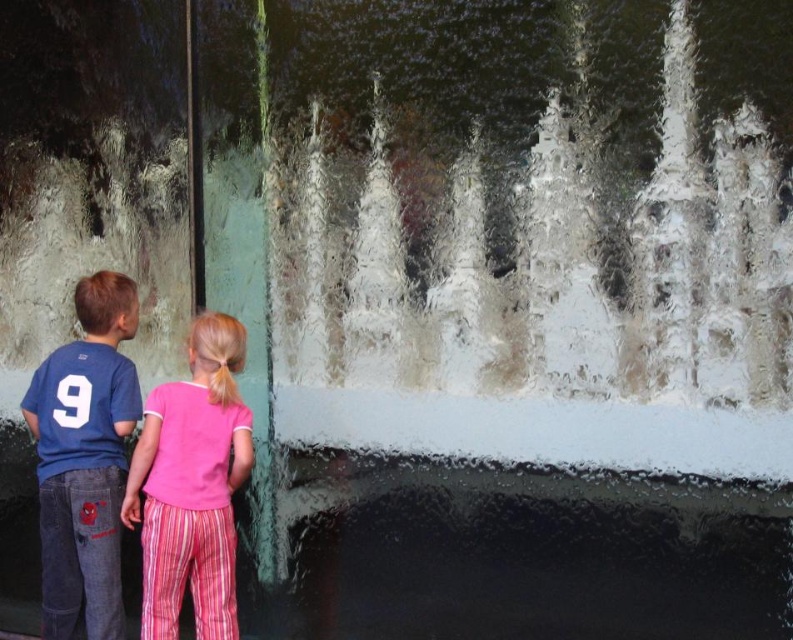
Consider the image. Between blue jersey at center and pink cotton shirt at center, which one has less height?

A: With less height is pink cotton shirt at center.

Where is `blue jersey at center`? The width and height of the screenshot is (793, 640). blue jersey at center is located at coordinates (83, 460).

Does point (67, 380) come closer to viewer compared to point (154, 566)?

No, (67, 380) is behind (154, 566).

The image size is (793, 640). I want to click on blue jersey at center, so click(x=83, y=460).